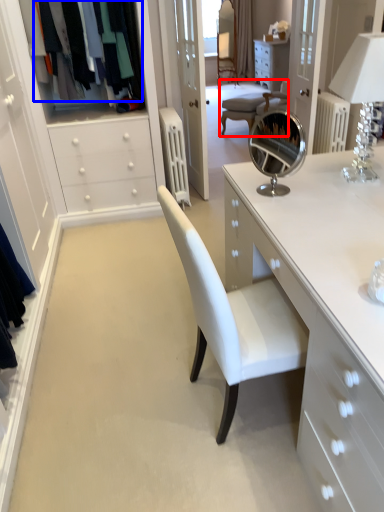
Question: Which point is closer to the camera, chair (highlighted by a red box) or clothing (highlighted by a blue box)?

Choices:
 (A) chair
 (B) clothing

Answer: (B)